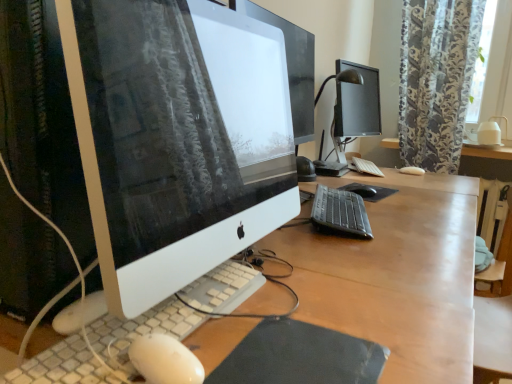
At what (x,y) coordinates should I click in order to perform the action: click on free space to the right of black plastic keyboard at center, marked as the 2th computer keyboard in a top-to-bottom arrangement. Please return your answer as a coordinate pair (x, y). Looking at the image, I should click on (412, 212).